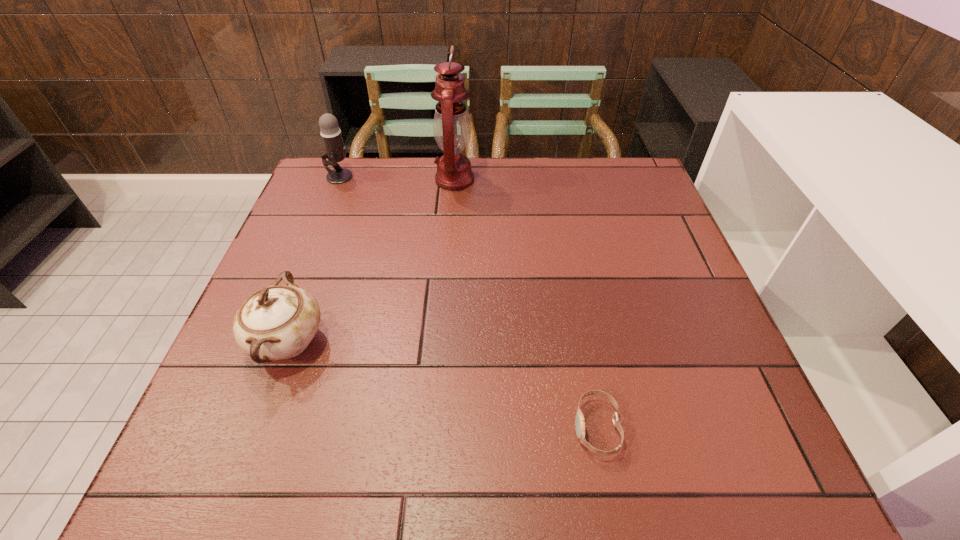
At what (x,y) coordinates should I click in order to perform the action: click on free space between the second shortest object and the tallest object. Please return your answer as a coordinate pair (x, y). Looking at the image, I should click on (372, 261).

This screenshot has width=960, height=540. I want to click on unoccupied area between the second tallest object and the watch, so click(468, 302).

Where is `free space that is in between the third farthest object and the rightmost object`? This screenshot has height=540, width=960. free space that is in between the third farthest object and the rightmost object is located at coordinates (443, 384).

Identify the location of free point between the microphone and the second nearest object. (314, 259).

Identify which object is the closest to the watch. Please provide its 2D coordinates. Your answer should be formatted as a tuple, i.e. [(x, y)], where the tuple contains the x and y coordinates of a point satisfying the conditions above.

[(278, 322)]

Choose which object is the second nearest neighbor to the nearest object. Please provide its 2D coordinates. Your answer should be formatted as a tuple, i.e. [(x, y)], where the tuple contains the x and y coordinates of a point satisfying the conditions above.

[(452, 129)]

The height and width of the screenshot is (540, 960). Find the location of `free space that satisfies the following two spatial constraints: 1. on the front side of the microphone; 2. on the right side of the tallest object`. free space that satisfies the following two spatial constraints: 1. on the front side of the microphone; 2. on the right side of the tallest object is located at coordinates coord(338,180).

The width and height of the screenshot is (960, 540). Identify the location of free spot that satisfies the following two spatial constraints: 1. on the back side of the second shortest object; 2. on the right side of the oil lamp. (348, 180).